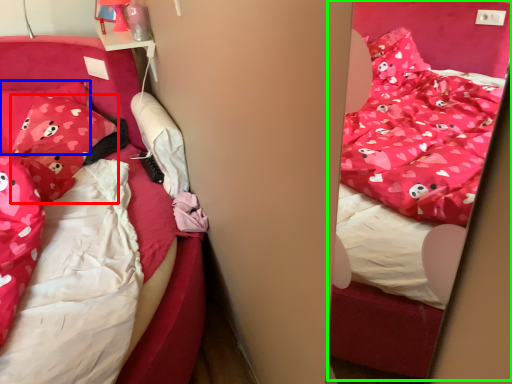
Question: Which object is positioned farthest from pillow (highlighted by a red box)? Select from pillow (highlighted by a blue box) and bed (highlighted by a green box).

Choices:
 (A) pillow
 (B) bed

Answer: (B)